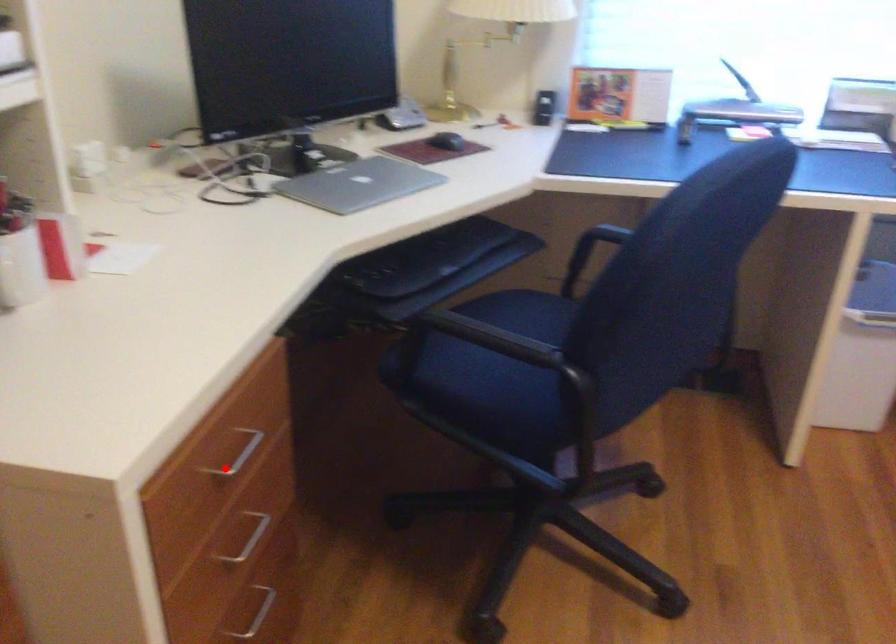
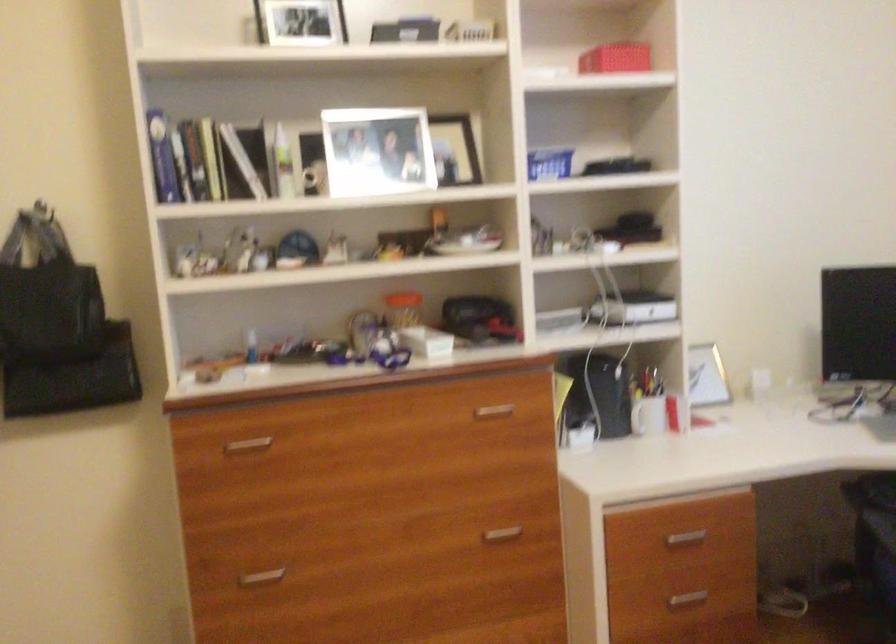
Question: A red point is marked in image1. In image2, is the corresponding 3D point closer to the camera or farther? Reply with the corresponding letter.

Choices:
 (A) The corresponding 3D point is closer.
 (B) The corresponding 3D point is farther.

Answer: (B)